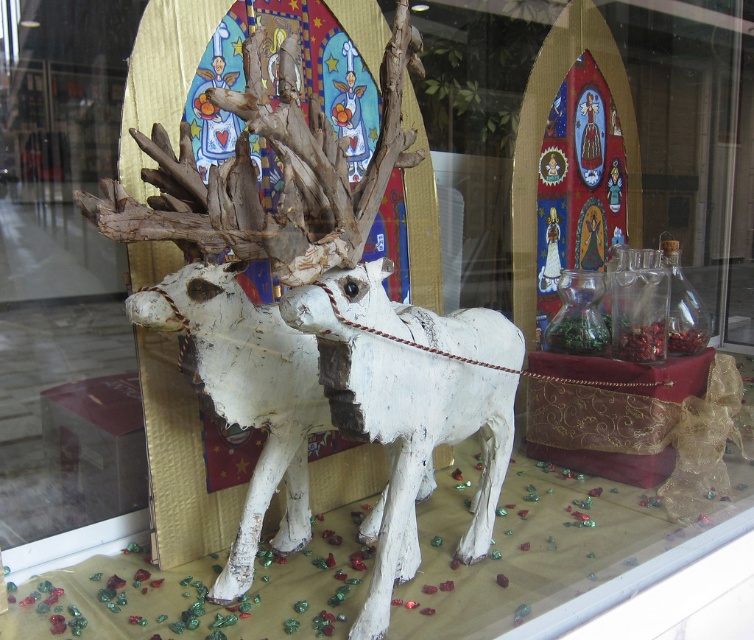
Question: Can you confirm if white matte reindeer at center is positioned below white painted wood reindeer at center?

Choices:
 (A) yes
 (B) no

Answer: (B)

Question: Is white matte reindeer at center wider than white painted wood reindeer at center?

Choices:
 (A) no
 (B) yes

Answer: (A)

Question: Which of the following is the farthest from the observer?

Choices:
 (A) white matte reindeer at center
 (B) white painted wood reindeer at center

Answer: (B)

Question: Can you confirm if white matte reindeer at center is bigger than white painted wood reindeer at center?

Choices:
 (A) no
 (B) yes

Answer: (B)